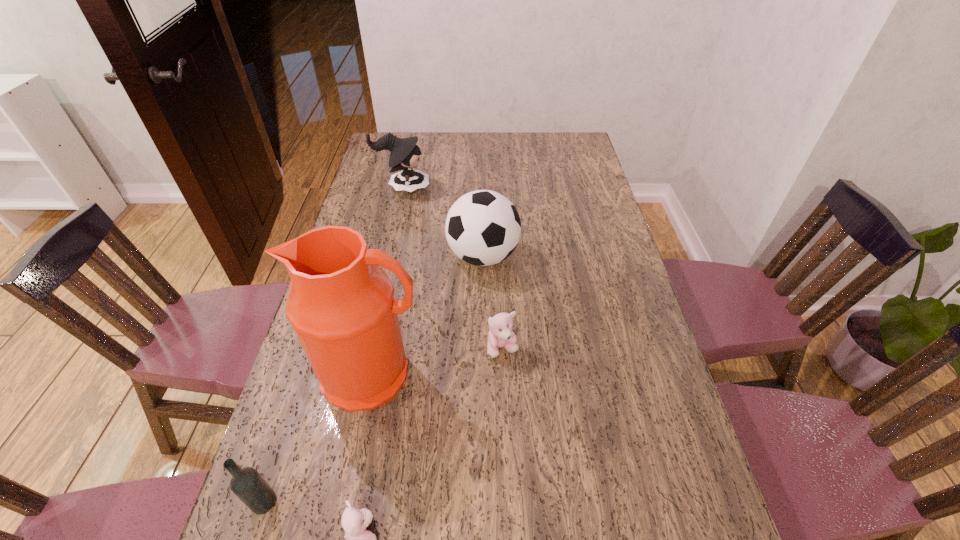
Identify the location of vacant area at the right edge. This screenshot has width=960, height=540. (643, 396).

The width and height of the screenshot is (960, 540). What are the coordinates of `vacant area at the near left corner` in the screenshot? It's located at (286, 525).

Identify the location of vacant area at the far right corner of the desktop. (553, 151).

Find the location of a particular element. This screenshot has width=960, height=540. unoccupied position between the soccer ball and the farthest object is located at coordinates (443, 222).

Where is `free point between the second shortest object and the second farthest object`? free point between the second shortest object and the second farthest object is located at coordinates (492, 302).

In order to click on vacant area between the leftmost object and the second shortest object in this screenshot , I will do `click(383, 425)`.

At what (x,y) coordinates should I click in order to perform the action: click on vacant area between the water jug and the soccer ball. Please return your answer as a coordinate pair (x, y). This screenshot has height=540, width=960. Looking at the image, I should click on [x=427, y=315].

Find the location of `vacant area that lies between the soccer ball and the taller teddy bear`. vacant area that lies between the soccer ball and the taller teddy bear is located at coordinates (492, 302).

At what (x,y) coordinates should I click in order to perform the action: click on the fifth closest object relative to the soccer ball. Please return your answer as a coordinate pair (x, y). This screenshot has width=960, height=540. Looking at the image, I should click on (247, 484).

Select which object is the fifth closest to the fifth tallest object. Please provide its 2D coordinates. Your answer should be formatted as a tuple, i.e. [(x, y)], where the tuple contains the x and y coordinates of a point satisfying the conditions above.

[(404, 155)]